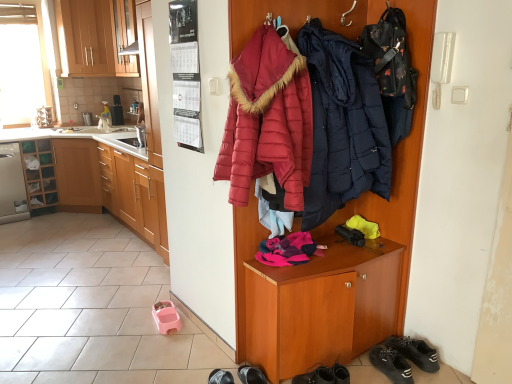
Question: Which is correct: metallic stainless steel toaster at left is inside wooden cabinet at right, or outside of it?

Choices:
 (A) inside
 (B) outside

Answer: (B)

Question: In terms of width, does metallic stainless steel toaster at left look wider or thinner when compared to wooden cabinet at right?

Choices:
 (A) wide
 (B) thin

Answer: (B)

Question: Which of these objects is positioned farthest from the wooden cabinet at left, the 2th cabinetry in the bottom-to-top sequence?

Choices:
 (A) metallic stainless steel toaster at left
 (B) wooden cabinet at left, acting as the third cabinetry starting from the top
 (C) satin silver dishwasher at left
 (D) quilted red jacket at center, which is counted as the 1th jacket, starting from the left
 (E) matte wood cabinets at upper left, positioned as the second cabinetry in left-to-right order

Answer: (D)

Question: Considering the real-world distances, which object is farthest from the transparent glass window at upper left?

Choices:
 (A) metallic stainless steel toaster at left
 (B) dark blue quilted jacket at center, the second jacket viewed from the left
 (C) black leather shoe at lower center, the 1th footwear when ordered from left to right
 (D) wooden cabinet at left, which ranks as the first cabinetry in right-to-left order
 (E) black suede sneakers at lower right, which is the first footwear in right-to-left order

Answer: (E)